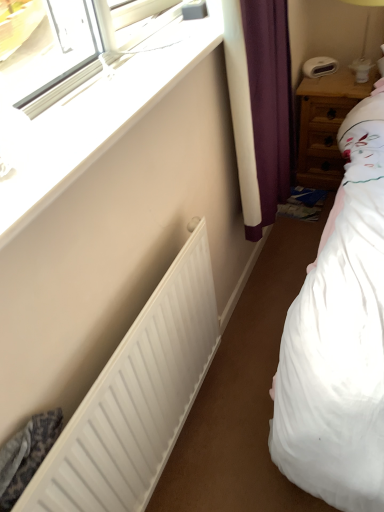
Identify the location of free point above wooden nightstand at right (from a real-world perspective). (346, 82).